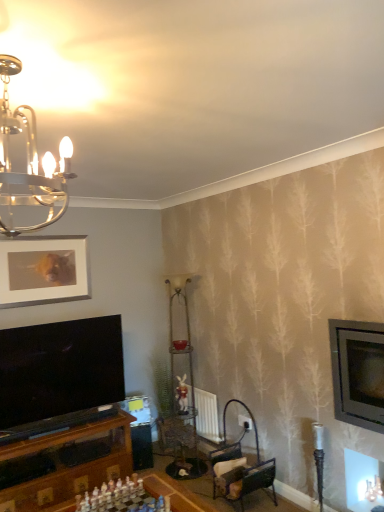
Where is `vacant space situated above matte white picture frame at upper left (from a real-world perspective)`? vacant space situated above matte white picture frame at upper left (from a real-world perspective) is located at coordinates (46, 234).